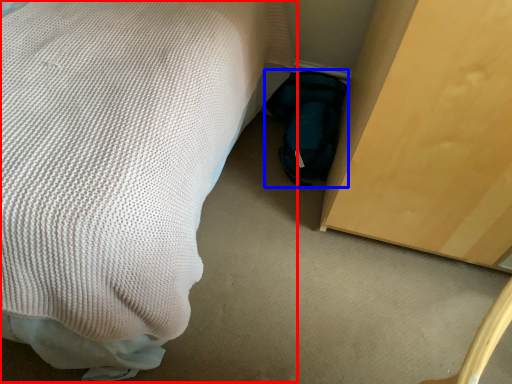
Question: Which object appears closest to the camera in this image, bed (highlighted by a red box) or bag (highlighted by a blue box)?

Choices:
 (A) bed
 (B) bag

Answer: (A)